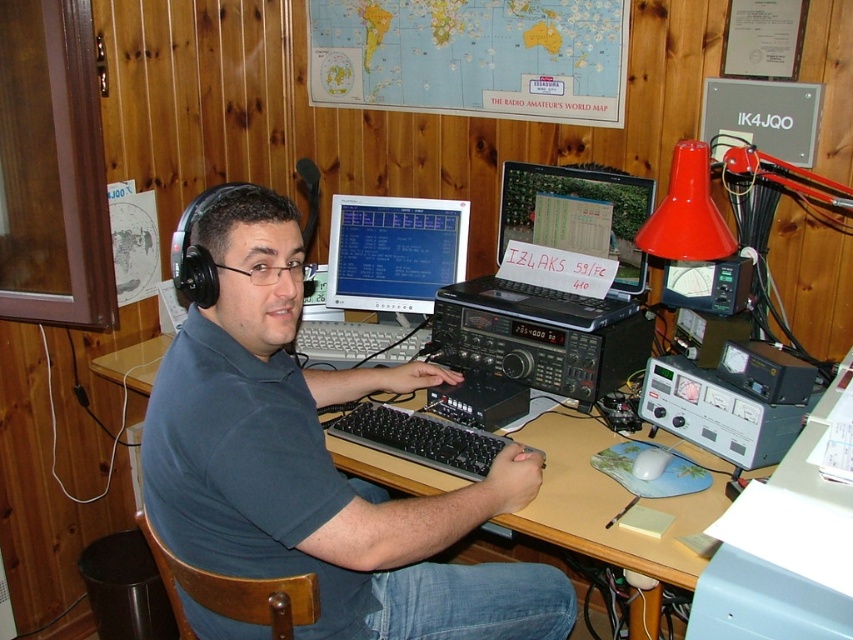
Question: Which point is closer to the camera taking this photo?

Choices:
 (A) (531, 170)
 (B) (409, 326)
 (C) (440, 214)

Answer: (A)

Question: Does dark blue shirt at center appear on the left side of matte plastic monitor at center?

Choices:
 (A) yes
 (B) no

Answer: (A)

Question: Does matte plastic monitor at center come in front of gray matte keyboard at center?

Choices:
 (A) yes
 (B) no

Answer: (B)

Question: Which of these objects is positioned closest to the dark blue shirt at center?

Choices:
 (A) matte plastic monitor at center
 (B) black plastic keyboard at center
 (C) wooden at center
 (D) matte black laptop at center

Answer: (B)

Question: Which point is closer to the camera taking this photo?

Choices:
 (A) (218, 305)
 (B) (628, 499)
 (C) (432, 419)
 (D) (370, 246)

Answer: (A)

Question: Is the position of wooden at center more distant than that of matte black laptop at center?

Choices:
 (A) no
 (B) yes

Answer: (A)